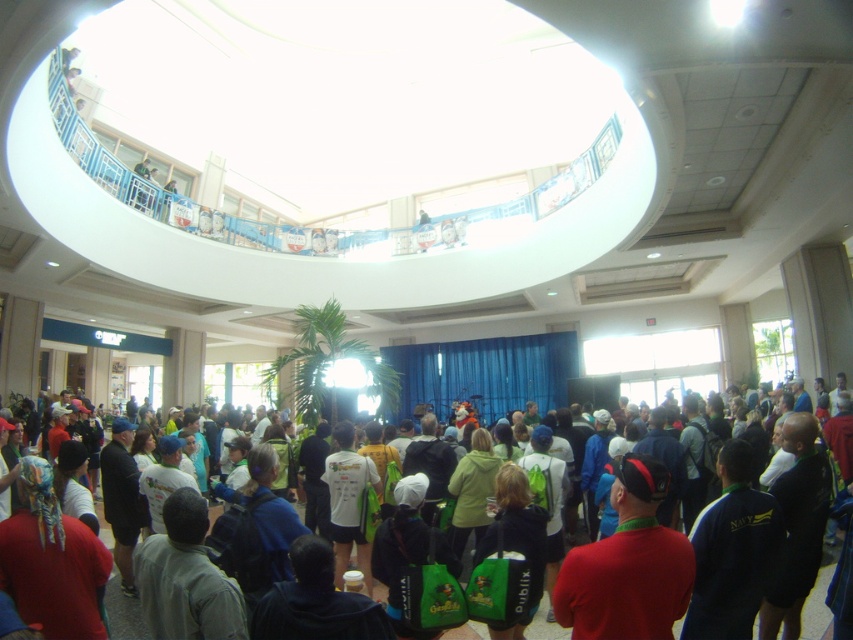
Question: Can you confirm if red matte shirt at center is positioned below green fabric backpack at center?

Choices:
 (A) yes
 (B) no

Answer: (B)

Question: Does red matte shirt at center appear over green fabric backpack at center?

Choices:
 (A) yes
 (B) no

Answer: (A)

Question: Which point appears closest to the camera in this image?

Choices:
 (A) (627, 637)
 (B) (547, 632)

Answer: (A)

Question: Is red matte shirt at center positioned in front of green fabric backpack at center?

Choices:
 (A) yes
 (B) no

Answer: (A)